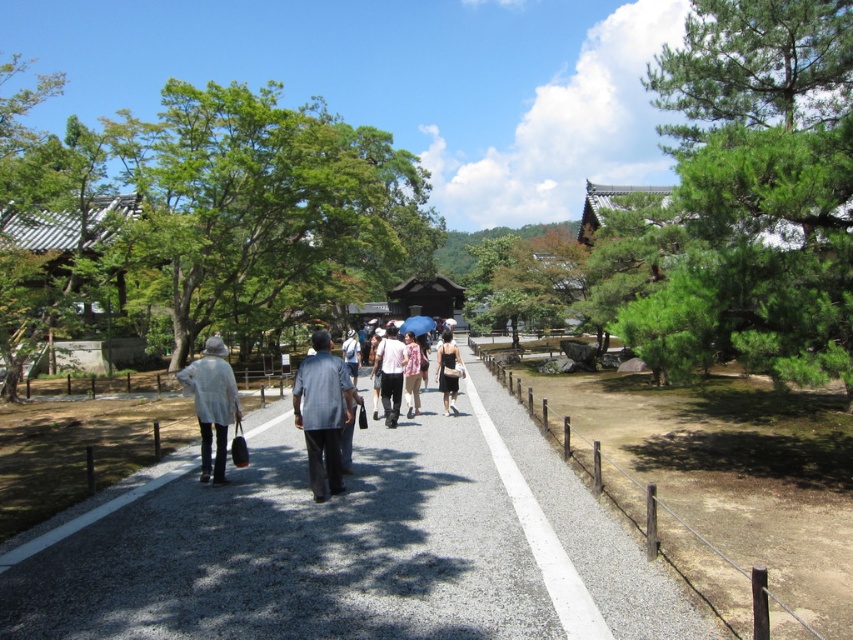
You are a photographer standing on the pathway and want to capture a photo of the white cotton shirt at center and the blue fabric umbrella at center. Which object is narrower in your photo?

The white cotton shirt at center is narrower than the blue fabric umbrella at center.

You are standing on the pathway and see two points marked in the scene. Which point is closer to you, point (387, 387) or point (405, 323)?

Point (387, 387) is closer to the viewer than point (405, 323).